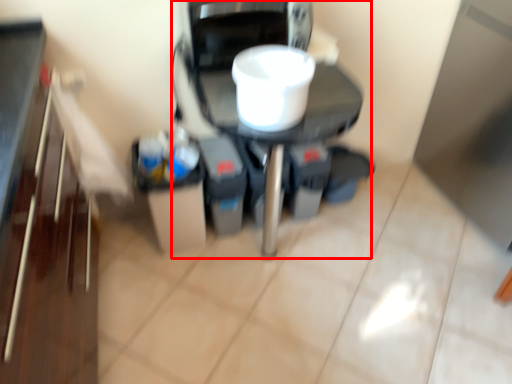
Question: From the image's perspective, what is the correct spatial relationship of appliance (annotated by the red box) in relation to appliance?

Choices:
 (A) below
 (B) above

Answer: (A)